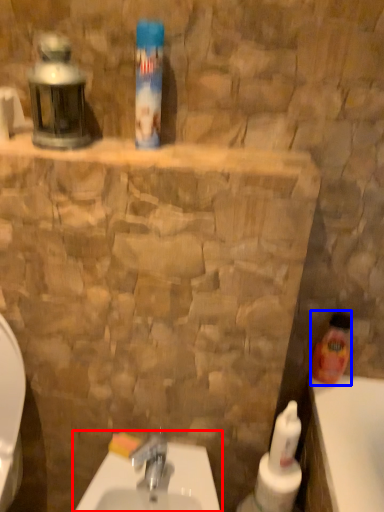
Question: Among these objects, which one is nearest to the camera, sink (highlighted by a red box) or cleaning product (highlighted by a blue box)?

Choices:
 (A) sink
 (B) cleaning product

Answer: (A)